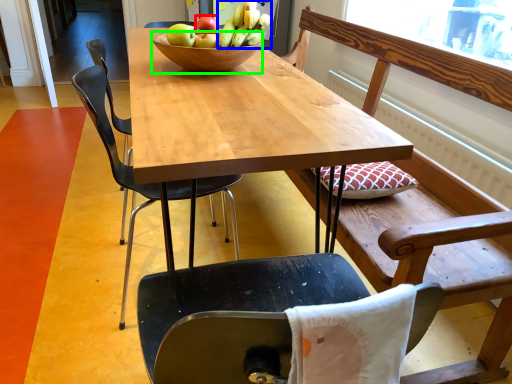
Question: Considering the real-world distances, which object is closest to apple (highlighted by a red box)? banana (highlighted by a blue box) or bowl (highlighted by a green box).

Choices:
 (A) banana
 (B) bowl

Answer: (A)